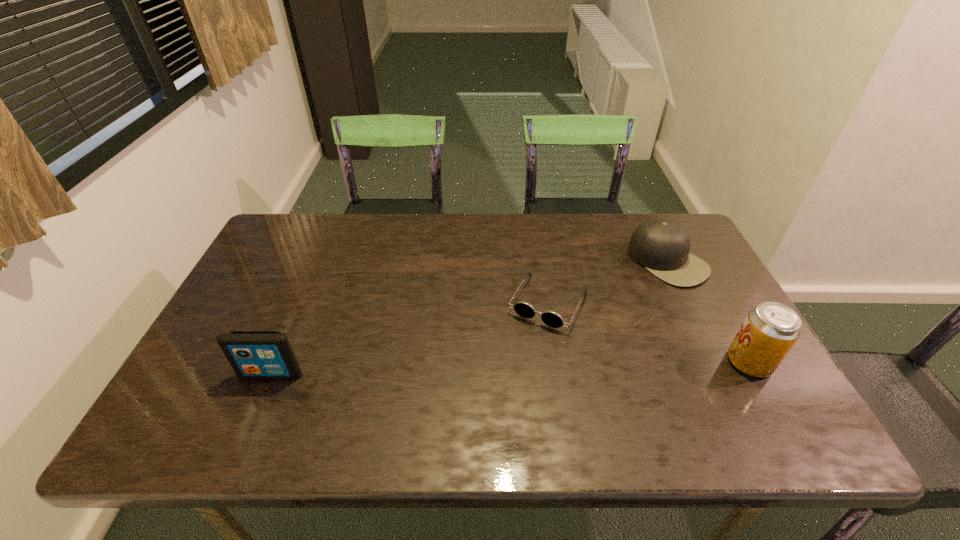
Where is `free space between the cap and the shortest object`? free space between the cap and the shortest object is located at coordinates (609, 282).

At what (x,y) coordinates should I click in order to perform the action: click on free space between the sunglasses and the pop (soda). Please return your answer as a coordinate pair (x, y). Looking at the image, I should click on (x=649, y=332).

Identify the location of free point between the second object from left to right and the third tallest object. The width and height of the screenshot is (960, 540). (609, 282).

The width and height of the screenshot is (960, 540). In order to click on blank region between the third shortest object and the second shortest object in this screenshot , I will do click(x=469, y=318).

You are a GUI agent. You are given a task and a screenshot of the screen. Output one action in this format:
    pyautogui.click(x=<x>, y=<y>)
    Task: Click on the vacant point located between the sunglasses and the iPod
    The image size is (960, 540).
    Given the screenshot: What is the action you would take?
    pyautogui.click(x=410, y=338)

Where is `vacant area between the second object from left to right and the cap`? vacant area between the second object from left to right and the cap is located at coordinates (609, 282).

Where is `free space between the leftmost object and the third tallest object`? This screenshot has width=960, height=540. free space between the leftmost object and the third tallest object is located at coordinates (469, 318).

In order to click on free space that is in between the cap and the pop (soda) in this screenshot , I will do tap(708, 312).

Locate an element on the screen. The image size is (960, 540). free space between the pop (soda) and the second tallest object is located at coordinates (511, 368).

Point out which object is positioned as the second nearest to the leftmost object. Please provide its 2D coordinates. Your answer should be formatted as a tuple, i.e. [(x, y)], where the tuple contains the x and y coordinates of a point satisfying the conditions above.

[(662, 246)]